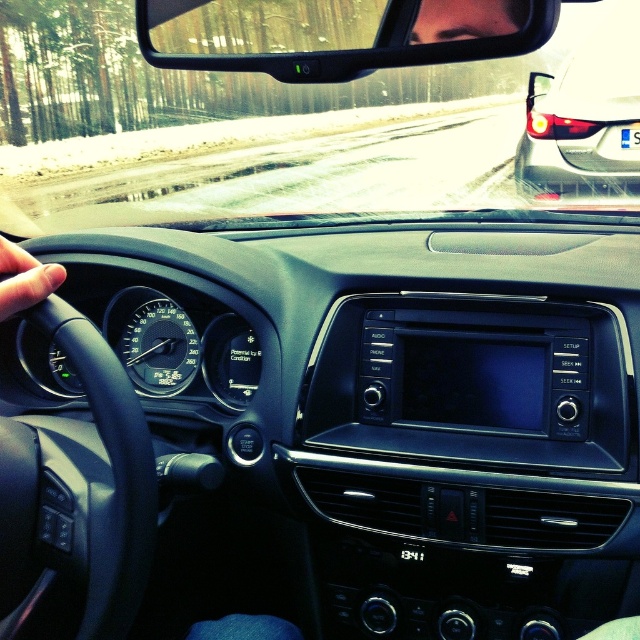
You are driving a car and need to check both the clear plastic view mirror at upper center and the black matte steering wheel at left. Which object would block your view more if placed directly in front of you?

The clear plastic view mirror at upper center has a larger size compared to the black matte steering wheel at left, so it would block your view more if placed directly in front of you.

Based on the photo, you are a car mechanic inspecting the dashboard of a vehicle. You notice the clear plastic view mirror at upper center and the black rubber steering wheel at left. Which object has a greater width?

The clear plastic view mirror at upper center has a greater width than the black rubber steering wheel at left according to the description.

You are a passenger in the car and need to check the rearview mirror. Where is the clear plastic view mirror at upper center positioned relative to the dashboard?

The clear plastic view mirror at upper center is positioned at point coordinates of (337, 33) on the dashboard.